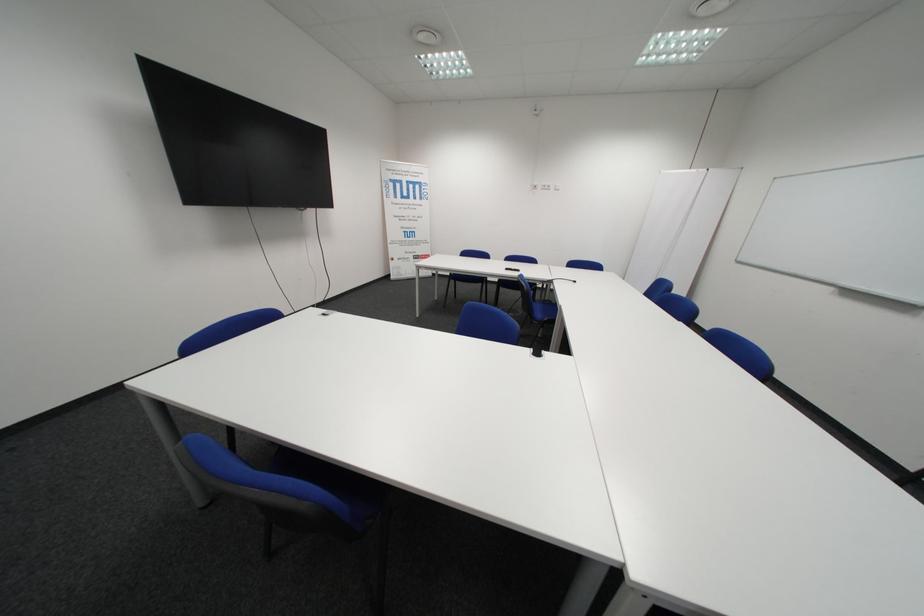
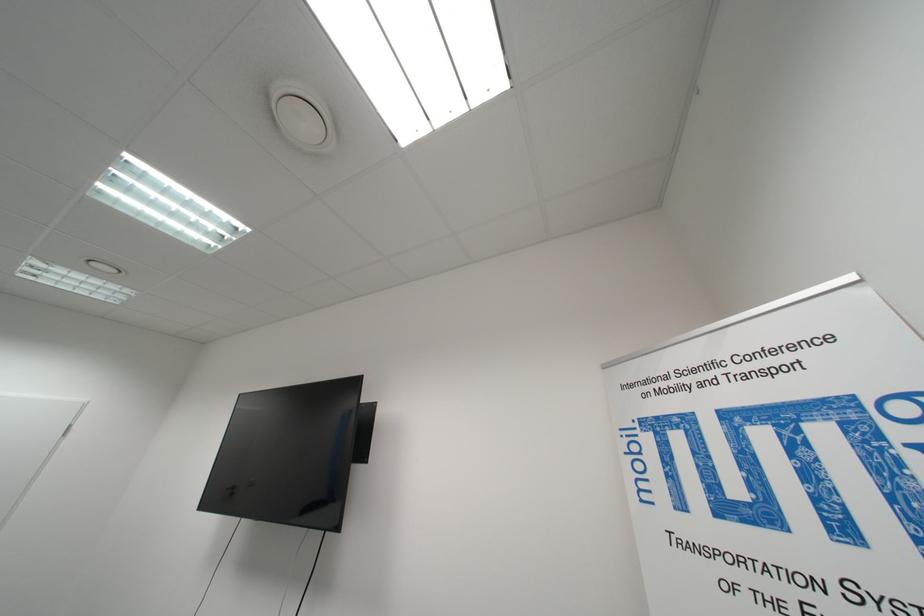
The point at (x=440, y=168) is marked in the first image. Where is the corresponding point in the second image?

(861, 278)